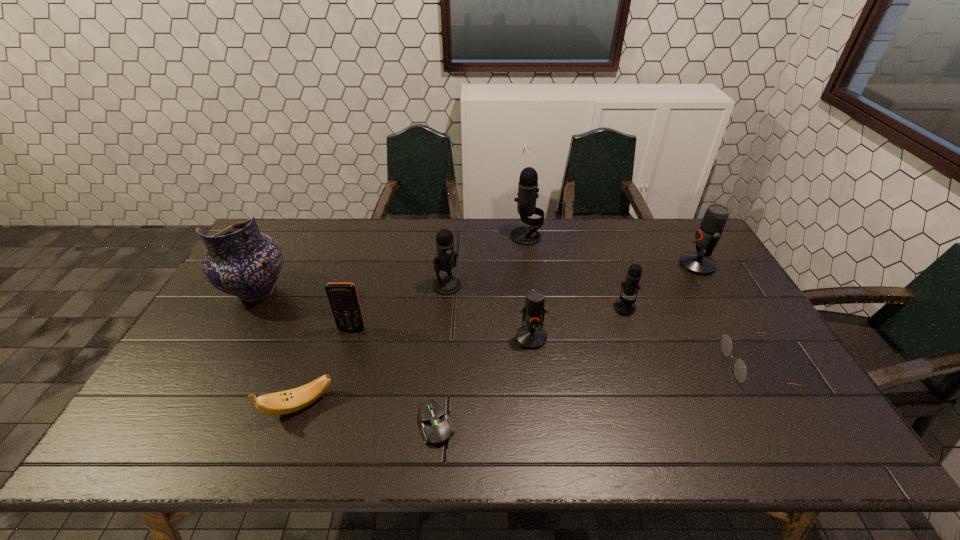
Find the location of a particular element. blank region between the leftmost black microphone and the banana is located at coordinates (373, 345).

Where is `vacant space in between the spectacles and the gray computer mouse`? vacant space in between the spectacles and the gray computer mouse is located at coordinates (595, 395).

The image size is (960, 540). In order to click on the second closest object to the second biggest black microphone in this screenshot , I will do `click(343, 298)`.

Select which object is the third closest to the fourth farthest microphone. Please provide its 2D coordinates. Your answer should be formatted as a tuple, i.e. [(x, y)], where the tuple contains the x and y coordinates of a point satisfying the conditions above.

[(707, 237)]

Locate which microphone is the second closest to the ninth tallest object. Please provide its 2D coordinates. Your answer should be formatted as a tuple, i.e. [(x, y)], where the tuple contains the x and y coordinates of a point satisfying the conditions above.

[(707, 237)]

The width and height of the screenshot is (960, 540). Find the location of `microphone that stands as the second closest to the banana`. microphone that stands as the second closest to the banana is located at coordinates tap(531, 336).

You are a GUI agent. You are given a task and a screenshot of the screen. Output one action in this format:
    pyautogui.click(x=<x>, y=<y>)
    Task: Click on the black microphone that is the second closest one to the gray computer mouse
    
    Given the screenshot: What is the action you would take?
    pyautogui.click(x=623, y=306)

This screenshot has width=960, height=540. I want to click on black microphone that is the third closest one to the blue pottery, so click(623, 306).

I want to click on free spot that satisfies the following two spatial constraints: 1. on the back side of the banana; 2. on the left side of the second nearest microphone, so click(334, 308).

Find the location of `free location that satisfies the following two spatial constraints: 1. on the back side of the second black microphone from left to right; 2. on the left side of the leftmost microphone`. free location that satisfies the following two spatial constraints: 1. on the back side of the second black microphone from left to right; 2. on the left side of the leftmost microphone is located at coordinates (451, 237).